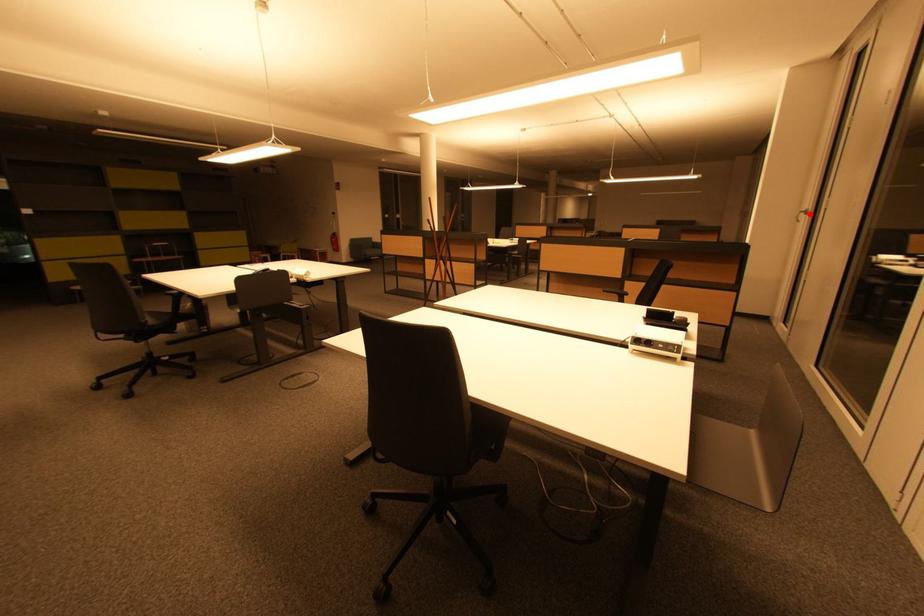
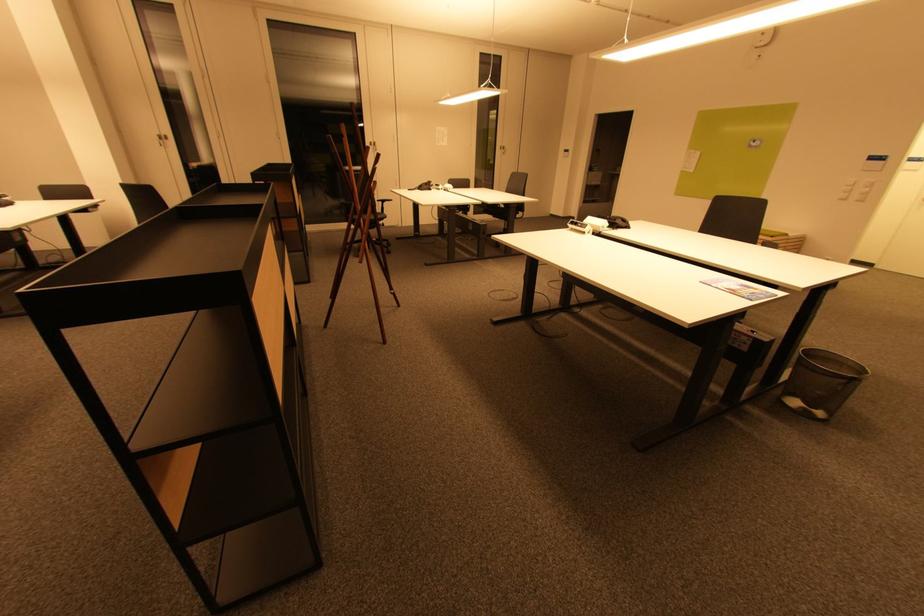
Find the pixel in the second image that matches the highlighted location in the first image.

(166, 140)